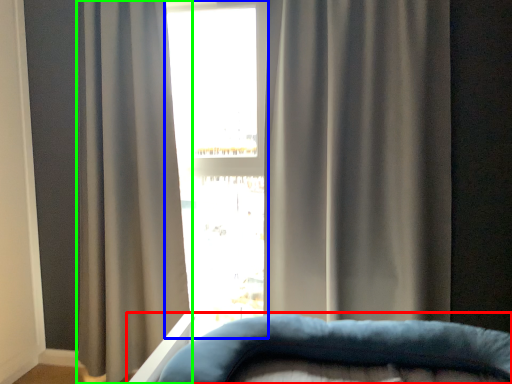
Question: Which object is positioned farthest from furniture (highlighted by a red box)? Select from bay window (highlighted by a blue box) and curtain (highlighted by a green box).

Choices:
 (A) bay window
 (B) curtain

Answer: (A)